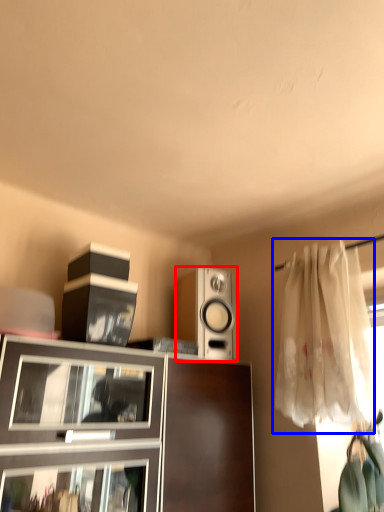
Question: Which of the following is the farthest to the observer, loudspeaker (highlighted by a red box) or curtain (highlighted by a blue box)?

Choices:
 (A) loudspeaker
 (B) curtain

Answer: (A)